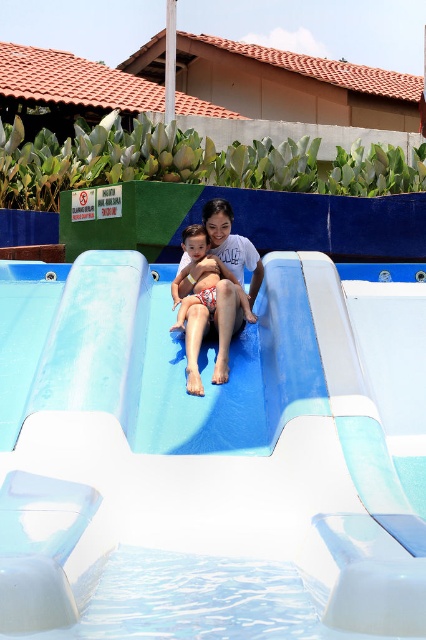
Between point (152, 449) and point (199, 269), which one is positioned behind?

Positioned behind is point (199, 269).

I want to click on white smooth slide at center, so click(210, 458).

This screenshot has height=640, width=426. In order to click on white smooth slide at center in this screenshot , I will do `click(210, 458)`.

Based on the photo, is white textured shorts at center above matte skin child at center?

Actually, white textured shorts at center is below matte skin child at center.

Is white textured shorts at center bigger than matte skin child at center?

Yes.

Is point (198, 276) behind point (259, 260)?

That is False.

This screenshot has width=426, height=640. Identify the location of white textured shorts at center. (207, 305).

Does white smooth slide at center lie behind matte skin child at center?

No, it is in front of matte skin child at center.

Does white smooth slide at center have a lesser width compared to matte skin child at center?

In fact, white smooth slide at center might be wider than matte skin child at center.

Identify the location of white smooth slide at center. (210, 458).

In order to click on white smooth slide at center in this screenshot , I will do `click(210, 458)`.